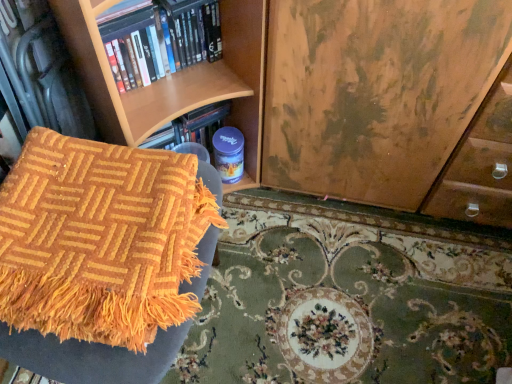
Question: From a real-world perspective, is orange woven blanket at lower left on top of orange woven mat at lower left?

Choices:
 (A) no
 (B) yes

Answer: (B)

Question: Considering the relative sizes of orange woven blanket at lower left and orange woven mat at lower left in the image provided, is orange woven blanket at lower left shorter than orange woven mat at lower left?

Choices:
 (A) no
 (B) yes

Answer: (A)

Question: Is orange woven blanket at lower left at the right side of orange woven mat at lower left?

Choices:
 (A) no
 (B) yes

Answer: (A)

Question: Is orange woven blanket at lower left surrounding orange woven mat at lower left?

Choices:
 (A) yes
 (B) no

Answer: (B)

Question: From the image's perspective, is orange woven blanket at lower left beneath orange woven mat at lower left?

Choices:
 (A) yes
 (B) no

Answer: (B)

Question: In terms of size, does orange woven mat at lower left appear bigger or smaller than orange woven blanket at lower left?

Choices:
 (A) small
 (B) big

Answer: (B)

Question: In the image, is orange woven mat at lower left positioned in front of or behind orange woven blanket at lower left?

Choices:
 (A) behind
 (B) front

Answer: (A)

Question: Considering the positions of point (274, 246) and point (36, 281), is point (274, 246) closer or farther from the camera than point (36, 281)?

Choices:
 (A) closer
 (B) farther

Answer: (B)

Question: From a real-world perspective, relative to orange woven blanket at lower left, is orange woven mat at lower left vertically above or below?

Choices:
 (A) above
 (B) below

Answer: (B)

Question: Would you say orange woven blanket at lower left is inside or outside orange woven mat at lower left?

Choices:
 (A) outside
 (B) inside

Answer: (A)

Question: In terms of width, does orange woven blanket at lower left look wider or thinner when compared to orange woven mat at lower left?

Choices:
 (A) wide
 (B) thin

Answer: (B)

Question: From a real-world perspective, is orange woven blanket at lower left physically located above or below orange woven mat at lower left?

Choices:
 (A) below
 (B) above

Answer: (B)

Question: Considering the positions of orange woven blanket at lower left and orange woven mat at lower left in the image, is orange woven blanket at lower left bigger or smaller than orange woven mat at lower left?

Choices:
 (A) big
 (B) small

Answer: (B)

Question: Which is correct: orange woven blanket at lower left is inside hardcover books at upper left, or outside of it?

Choices:
 (A) inside
 (B) outside

Answer: (B)

Question: Would you say orange woven blanket at lower left is to the left or to the right of hardcover books at upper left in the picture?

Choices:
 (A) left
 (B) right

Answer: (A)